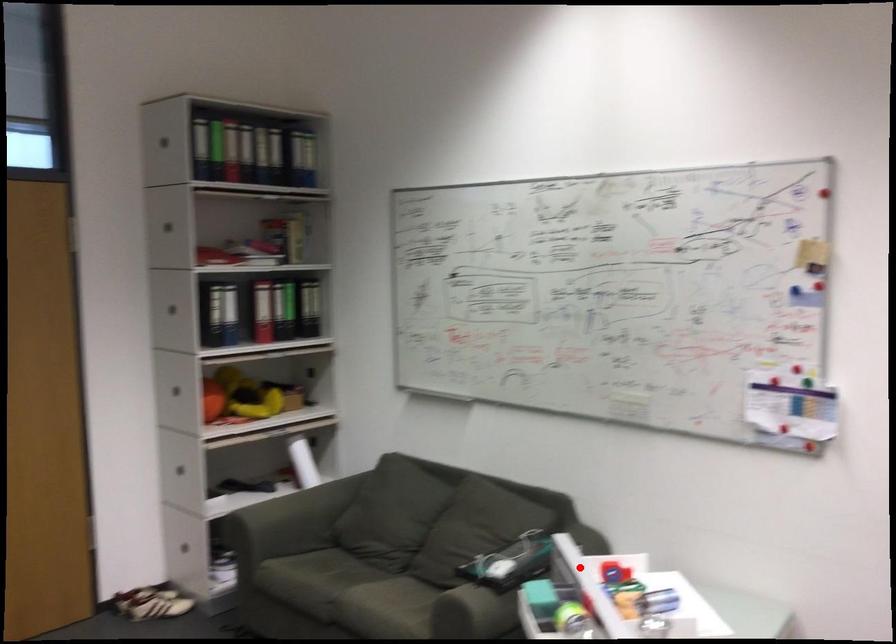
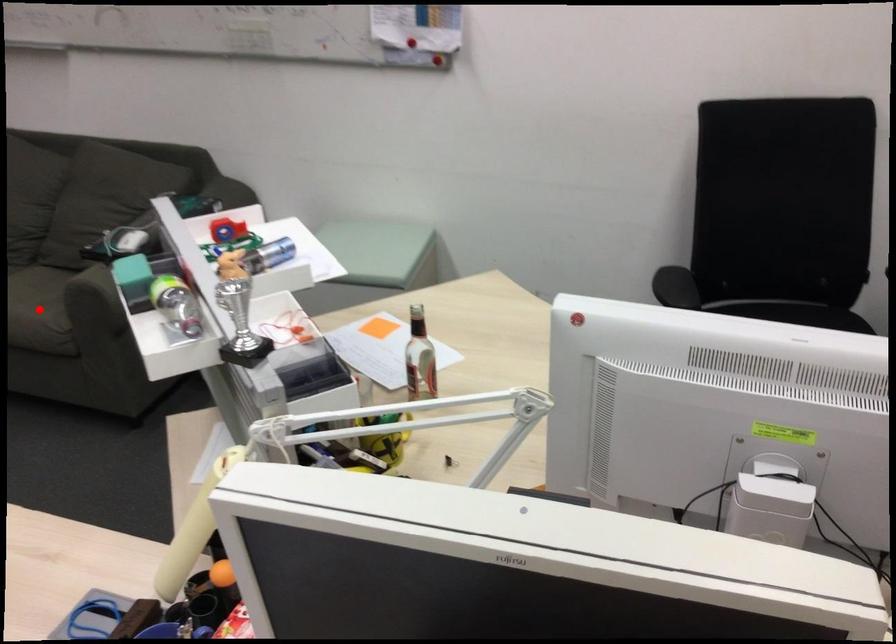
I am providing you with two images of the same scene from different viewpoints. A red point is marked on the first image and another point is marked on the second image. Is the red point in image1 aligned with the point shown in image2?

No